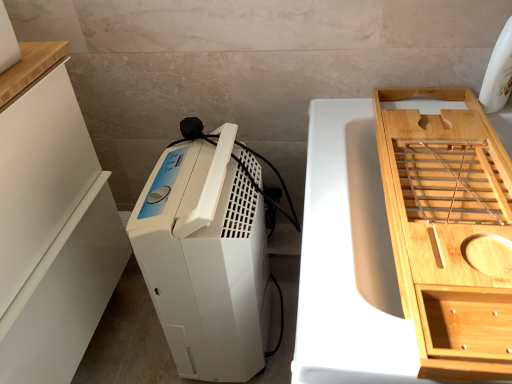
In order to click on white plastic dehumidifier at center in this screenshot , I will do `click(206, 257)`.

The image size is (512, 384). Describe the element at coordinates (348, 259) in the screenshot. I see `bamboo tray at right` at that location.

Locate an element on the screen. bamboo tray at right is located at coordinates (348, 259).

At what (x,y) coordinates should I click in order to perform the action: click on light wood/texture bamboo tray at right, the first cabinetry from the right. Please return your answer as a coordinate pair (x, y). The width and height of the screenshot is (512, 384). Looking at the image, I should click on (448, 230).

Which object is positioned more to the left, white plastic dehumidifier at center or white matte cabinet at left, which is counted as the second cabinetry, starting from the right?

white matte cabinet at left, which is counted as the second cabinetry, starting from the right.

Identify the location of the 1st cabinetry above the white plastic dehumidifier at center (from the image's perspective). The image size is (512, 384). (52, 234).

Is white plastic dehumidifier at center smaller than white matte cabinet at left, which is counted as the second cabinetry, starting from the right?

Yes, white plastic dehumidifier at center is smaller than white matte cabinet at left, which is counted as the second cabinetry, starting from the right.

Considering the sizes of objects white plastic dehumidifier at center and white matte cabinet at left, which is counted as the second cabinetry, starting from the right, in the image provided, who is shorter, white plastic dehumidifier at center or white matte cabinet at left, which is counted as the second cabinetry, starting from the right,?

Standing shorter between the two is white plastic dehumidifier at center.

Considering the positions of objects white matte cabinet at left, acting as the 1th cabinetry starting from the left, and light wood/texture bamboo tray at right, which ranks as the 2th cabinetry in left-to-right order, in the image provided, who is more to the right, white matte cabinet at left, acting as the 1th cabinetry starting from the left, or light wood/texture bamboo tray at right, which ranks as the 2th cabinetry in left-to-right order,?

light wood/texture bamboo tray at right, which ranks as the 2th cabinetry in left-to-right order, is more to the right.

Considering their positions, is white matte cabinet at left, which is counted as the second cabinetry, starting from the right, located in front of or behind light wood/texture bamboo tray at right, the first cabinetry from the right?

In the image, white matte cabinet at left, which is counted as the second cabinetry, starting from the right, appears behind light wood/texture bamboo tray at right, the first cabinetry from the right.

Choose the correct answer: Is white matte cabinet at left, acting as the 1th cabinetry starting from the left, inside light wood/texture bamboo tray at right, which ranks as the 2th cabinetry in left-to-right order, or outside it?

white matte cabinet at left, acting as the 1th cabinetry starting from the left, is located beyond the bounds of light wood/texture bamboo tray at right, which ranks as the 2th cabinetry in left-to-right order.

The width and height of the screenshot is (512, 384). Identify the location of the 1st cabinetry positioned above the bamboo tray at right (from a real-world perspective). (52, 234).

Measure the distance from bamboo tray at right to white matte cabinet at left, which is counted as the second cabinetry, starting from the right.

bamboo tray at right and white matte cabinet at left, which is counted as the second cabinetry, starting from the right, are 21.80 inches apart from each other.

Between bamboo tray at right and white matte cabinet at left, which is counted as the second cabinetry, starting from the right, which one is positioned behind?

white matte cabinet at left, which is counted as the second cabinetry, starting from the right, is further from the camera.

Are bamboo tray at right and white matte cabinet at left, acting as the 1th cabinetry starting from the left, located far from each other?

Actually, bamboo tray at right and white matte cabinet at left, acting as the 1th cabinetry starting from the left, are a little close together.

Considering the positions of objects white matte cabinet at left, acting as the 1th cabinetry starting from the left, and white plastic dehumidifier at center in the image provided, who is behind, white matte cabinet at left, acting as the 1th cabinetry starting from the left, or white plastic dehumidifier at center?

white plastic dehumidifier at center is further away from the camera.

Consider the image. Is white plastic dehumidifier at center at the back of white matte cabinet at left, which is counted as the second cabinetry, starting from the right?

No, white matte cabinet at left, which is counted as the second cabinetry, starting from the right, is not facing the opposite direction of white plastic dehumidifier at center.

From a real-world perspective, is white matte cabinet at left, acting as the 1th cabinetry starting from the left, physically located above or below white plastic dehumidifier at center?

white matte cabinet at left, acting as the 1th cabinetry starting from the left, is situated higher than white plastic dehumidifier at center in the real world.

How different are the orientations of white matte cabinet at left, which is counted as the second cabinetry, starting from the right, and bamboo tray at right in degrees?

The angular difference between white matte cabinet at left, which is counted as the second cabinetry, starting from the right, and bamboo tray at right is 90 degrees.

Does white matte cabinet at left, which is counted as the second cabinetry, starting from the right, have a larger size compared to bamboo tray at right?

Correct, white matte cabinet at left, which is counted as the second cabinetry, starting from the right, is larger in size than bamboo tray at right.

Based on the photo, between white matte cabinet at left, acting as the 1th cabinetry starting from the left, and bamboo tray at right, which one appears on the left side from the viewer's perspective?

Positioned to the left is white matte cabinet at left, acting as the 1th cabinetry starting from the left.

Does white matte cabinet at left, which is counted as the second cabinetry, starting from the right, touch bamboo tray at right?

No, white matte cabinet at left, which is counted as the second cabinetry, starting from the right, is not touching bamboo tray at right.

Find the location of a particular element. the 2nd cabinetry in front of the white plastic dehumidifier at center is located at coordinates (448, 230).

How different are the orientations of light wood/texture bamboo tray at right, the first cabinetry from the right, and white plastic dehumidifier at center in degrees?

They differ by 0.73 degrees in their facing directions.

Who is taller, light wood/texture bamboo tray at right, which ranks as the 2th cabinetry in left-to-right order, or white plastic dehumidifier at center?

Standing taller between the two is white plastic dehumidifier at center.

Which is less distant, (x=442, y=340) or (x=247, y=376)?

Point (x=442, y=340) is positioned closer to the camera compared to point (x=247, y=376).

The height and width of the screenshot is (384, 512). I want to click on home appliance on the left of bamboo tray at right, so click(x=206, y=257).

From the image's perspective, who appears lower, bamboo tray at right or white plastic dehumidifier at center?

bamboo tray at right appears lower in the image.

Is bamboo tray at right not close to white plastic dehumidifier at center?

They are positioned close to each other.

Find the location of a particular element. This screenshot has width=512, height=384. home appliance below the white matte cabinet at left, which is counted as the second cabinetry, starting from the right (from a real-world perspective) is located at coordinates coord(206,257).

At what (x,y) coordinates should I click in order to perform the action: click on cabinetry that is behind the light wood/texture bamboo tray at right, the first cabinetry from the right. Please return your answer as a coordinate pair (x, y). The image size is (512, 384). Looking at the image, I should click on (52, 234).

Estimate the real-world distances between objects in this image. Which object is closer to light wood/texture bamboo tray at right, the first cabinetry from the right, bamboo tray at right or white plastic dehumidifier at center?

bamboo tray at right.

From the image, which object appears to be farther from white plastic dehumidifier at center, light wood/texture bamboo tray at right, which ranks as the 2th cabinetry in left-to-right order, or white matte cabinet at left, which is counted as the second cabinetry, starting from the right?

Among the two, light wood/texture bamboo tray at right, which ranks as the 2th cabinetry in left-to-right order, is located further to white plastic dehumidifier at center.

Considering their positions, is light wood/texture bamboo tray at right, the first cabinetry from the right, positioned further to white plastic dehumidifier at center than bamboo tray at right?

The object further to white plastic dehumidifier at center is light wood/texture bamboo tray at right, the first cabinetry from the right.

From the image, which object appears to be farther from light wood/texture bamboo tray at right, the first cabinetry from the right, white matte cabinet at left, which is counted as the second cabinetry, starting from the right, or white plastic dehumidifier at center?

Among the two, white matte cabinet at left, which is counted as the second cabinetry, starting from the right, is located further to light wood/texture bamboo tray at right, the first cabinetry from the right.

Looking at the image, which one is located closer to bamboo tray at right, white matte cabinet at left, which is counted as the second cabinetry, starting from the right, or light wood/texture bamboo tray at right, which ranks as the 2th cabinetry in left-to-right order?

light wood/texture bamboo tray at right, which ranks as the 2th cabinetry in left-to-right order, is positioned closer to the anchor bamboo tray at right.

Based on their spatial positions, is bamboo tray at right or light wood/texture bamboo tray at right, which ranks as the 2th cabinetry in left-to-right order, closer to white matte cabinet at left, which is counted as the second cabinetry, starting from the right?

Among the two, bamboo tray at right is located nearer to white matte cabinet at left, which is counted as the second cabinetry, starting from the right.

Considering their positions, is bamboo tray at right positioned further to light wood/texture bamboo tray at right, which ranks as the 2th cabinetry in left-to-right order, than white matte cabinet at left, acting as the 1th cabinetry starting from the left?

white matte cabinet at left, acting as the 1th cabinetry starting from the left.

Estimate the real-world distances between objects in this image. Which object is further from bamboo tray at right, light wood/texture bamboo tray at right, the first cabinetry from the right, or white plastic dehumidifier at center?

white plastic dehumidifier at center lies further to bamboo tray at right than the other object.

Locate an element on the screen. The width and height of the screenshot is (512, 384). cabinetry between white plastic dehumidifier at center and bamboo tray at right is located at coordinates point(448,230).

Find the location of `home appliance between white matte cabinet at left, acting as the 1th cabinetry starting from the left, and bamboo tray at right, in the horizontal direction`. home appliance between white matte cabinet at left, acting as the 1th cabinetry starting from the left, and bamboo tray at right, in the horizontal direction is located at coordinates (206, 257).

Where is `home appliance located between white matte cabinet at left, acting as the 1th cabinetry starting from the left, and light wood/texture bamboo tray at right, the first cabinetry from the right, in the left-right direction`? The width and height of the screenshot is (512, 384). home appliance located between white matte cabinet at left, acting as the 1th cabinetry starting from the left, and light wood/texture bamboo tray at right, the first cabinetry from the right, in the left-right direction is located at coordinates (206, 257).

Identify the location of cabinetry located between white matte cabinet at left, which is counted as the second cabinetry, starting from the right, and bamboo tray at right in the left-right direction. This screenshot has width=512, height=384. (448, 230).